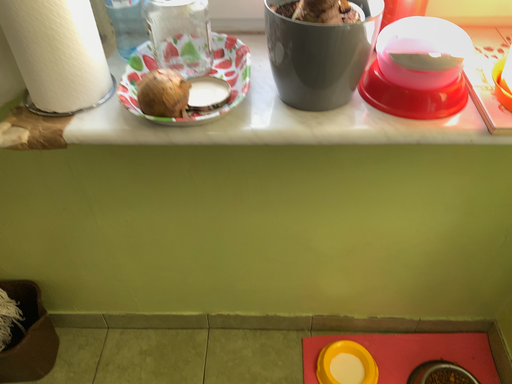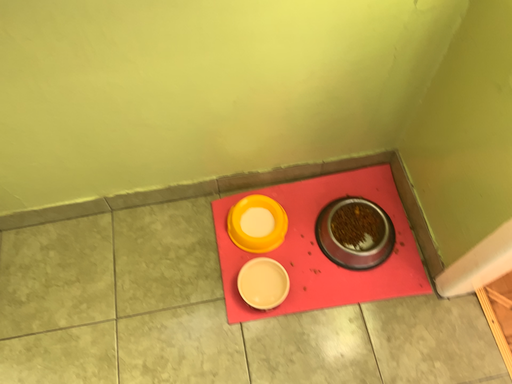
Question: Which way did the camera rotate in the video?

Choices:
 (A) rotated upward
 (B) rotated downward

Answer: (B)